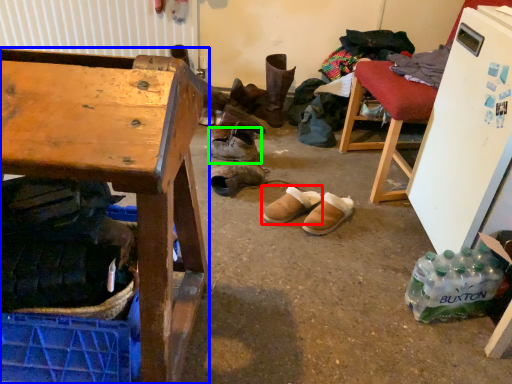
Question: Based on their relative distances, which object is nearer to footwear (highlighted by a red box)? Choose from desk (highlighted by a blue box) and footwear (highlighted by a green box).

Choices:
 (A) desk
 (B) footwear

Answer: (B)